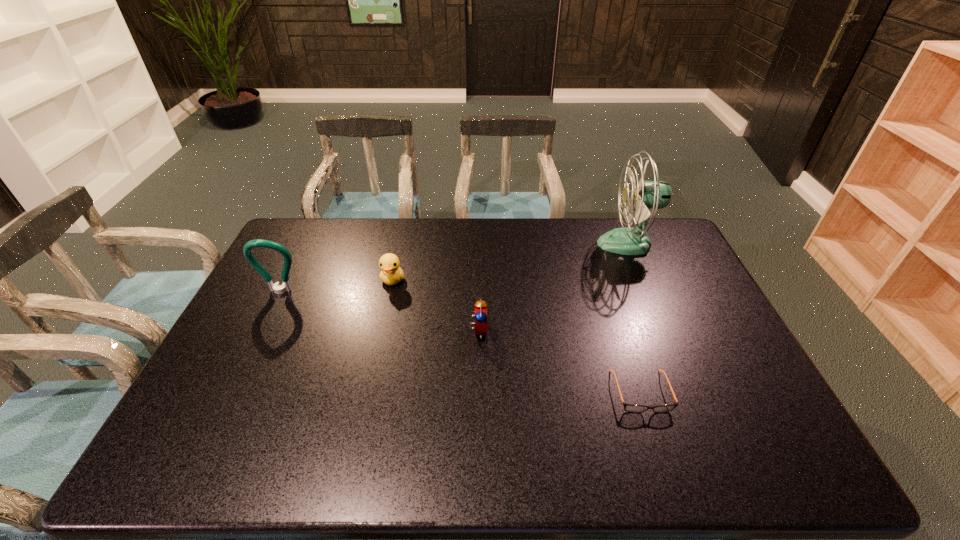
Image resolution: width=960 pixels, height=540 pixels. In the image, there is a desktop. Find the location of `free region at the far edge`. free region at the far edge is located at coordinates (441, 221).

I want to click on vacant space at the near edge of the desktop, so click(464, 458).

The width and height of the screenshot is (960, 540). Identify the location of vacant space at the left edge. (214, 413).

Find the location of a particular element. The height and width of the screenshot is (540, 960). free location at the right edge is located at coordinates (764, 392).

Find the location of a particular element. The width and height of the screenshot is (960, 540). free space at the far left corner of the desktop is located at coordinates (302, 249).

The height and width of the screenshot is (540, 960). I want to click on vacant space at the near right corner of the desktop, so click(779, 441).

Where is `free point between the fan and the fourth object from right to left`? Image resolution: width=960 pixels, height=540 pixels. free point between the fan and the fourth object from right to left is located at coordinates (511, 262).

Identify the location of blank region between the shortest object and the leftmost object. This screenshot has width=960, height=540. (461, 342).

The image size is (960, 540). I want to click on unoccupied area between the third object from left to right and the nearest object, so click(x=560, y=361).

The height and width of the screenshot is (540, 960). I want to click on free space between the alarm clock and the leftmost object, so click(379, 311).